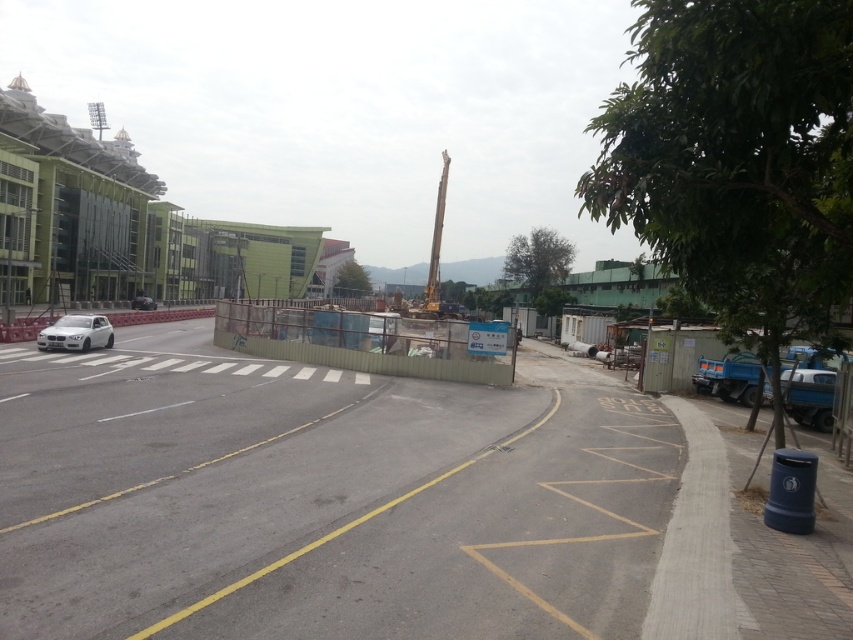
You are a delivery person trying to see if you can spot the construction site from the sidewalk. The metal fence at center and the metallic yellow crane at center are in your line of sight. Which object would block your view of the construction site more?

The metallic yellow crane at center is taller than the metal fence at center, so it would block your view more.

You are a delivery driver who needs to park your vehicle at the construction site. The entrance to the construction site is located at point (x=76, y=333). Your vehicle is a large truck that is 2 meters wide. Is there enough space to park your truck at the entrance without blocking the pedestrian crossing?

The entrance to the construction site at point (x=76, y=333) is occupied by a sleek silver sedan at left, so there is not enough space to park the large truck there without blocking the pedestrian crossing.